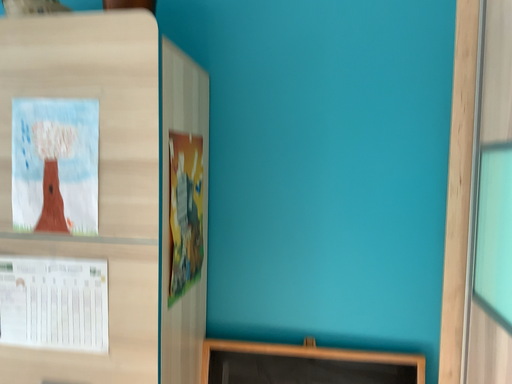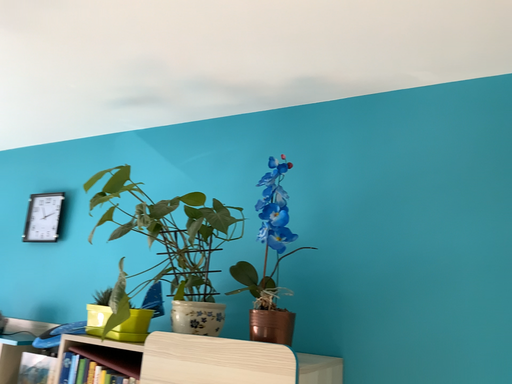
Question: Which way did the camera rotate in the video?

Choices:
 (A) rotated downward
 (B) rotated upward

Answer: (B)